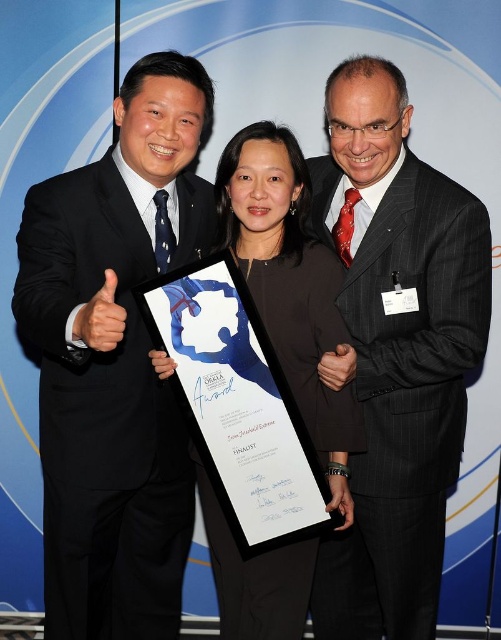
Which is more to the left, matte black suit at left or black fabric dress at center?

Positioned to the left is matte black suit at left.

Where is `matte black suit at left`? The width and height of the screenshot is (501, 640). matte black suit at left is located at coordinates (115, 358).

I want to click on matte black suit at left, so click(115, 358).

Is black pinstripe suit at center positioned behind black fabric dress at center?

That is False.

From the picture: Between black pinstripe suit at center and black fabric dress at center, which one has more height?

black pinstripe suit at center is taller.

Locate an element on the screen. The width and height of the screenshot is (501, 640). black pinstripe suit at center is located at coordinates (395, 349).

Between matte black suit at left and black pinstripe suit at center, which one appears on the left side from the viewer's perspective?

matte black suit at left is more to the left.

Identify the location of matte black suit at left. The height and width of the screenshot is (640, 501). (115, 358).